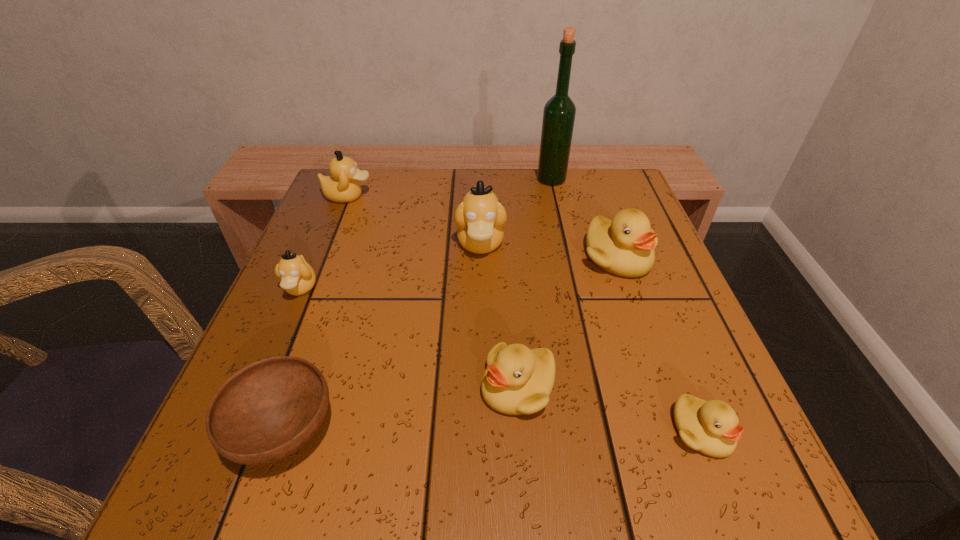
I want to click on the shortest duckling, so click(x=711, y=427).

This screenshot has height=540, width=960. What are the coordinates of `vacant space positioned 0.050m on the right of the liquor` in the screenshot? It's located at (586, 179).

Find the location of a particular element. free space located on the face of the biggest tan duckling is located at coordinates (481, 368).

Where is `free spot located on the face of the farthest duckling`? free spot located on the face of the farthest duckling is located at coordinates (419, 197).

The width and height of the screenshot is (960, 540). Find the location of `vacant point located on the front-facing side of the farthest yellow duckling`. vacant point located on the front-facing side of the farthest yellow duckling is located at coordinates (646, 338).

Identify the location of vacant space located 0.330m on the front-facing side of the leftmost yellow duckling. This screenshot has width=960, height=540. (266, 388).

At what (x,y) coordinates should I click in order to perform the action: click on vacant region located 0.290m on the front-facing side of the leftmost yellow duckling. Please return your answer as a coordinate pair (x, y). This screenshot has height=540, width=960. Looking at the image, I should click on (292, 388).

The height and width of the screenshot is (540, 960). What are the coordinates of `vacant space located on the front-facing side of the leftmost yellow duckling` in the screenshot? It's located at (364, 388).

The width and height of the screenshot is (960, 540). I want to click on vacant space located 0.150m on the face of the smallest tan duckling, so click(x=264, y=375).

This screenshot has height=540, width=960. I want to click on vacant space located on the right of the bowl, so click(401, 432).